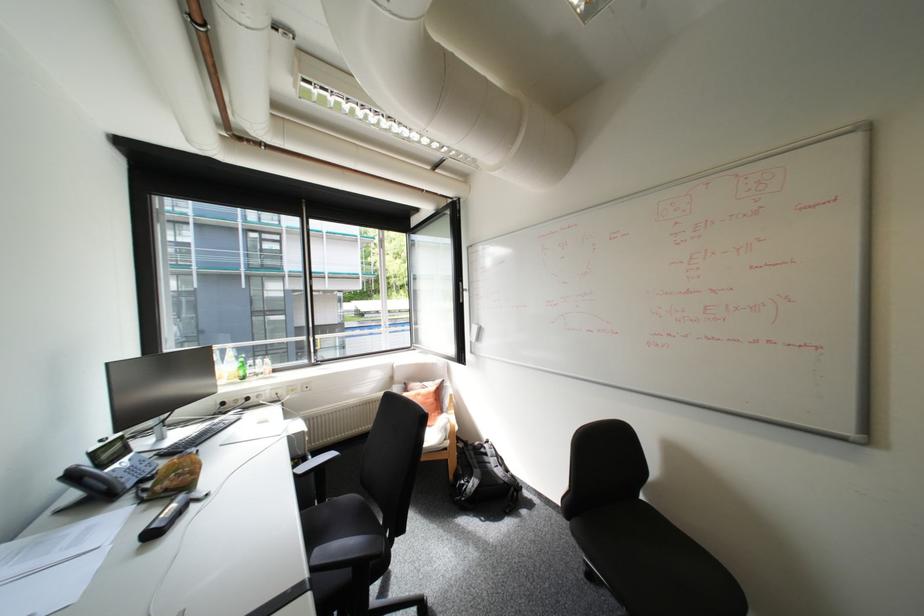
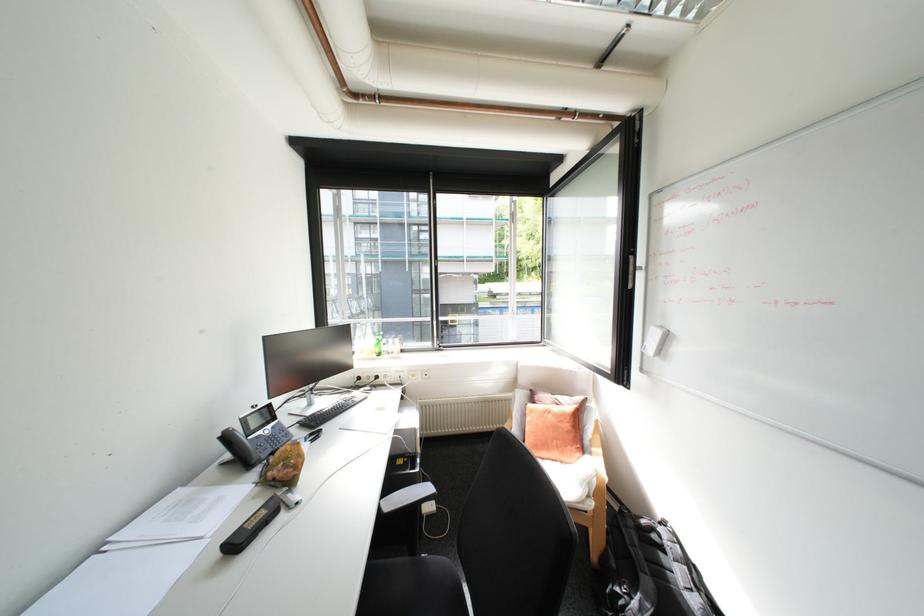
Find the pixel in the second image that matches (x=313, y=432) in the first image.

(424, 429)